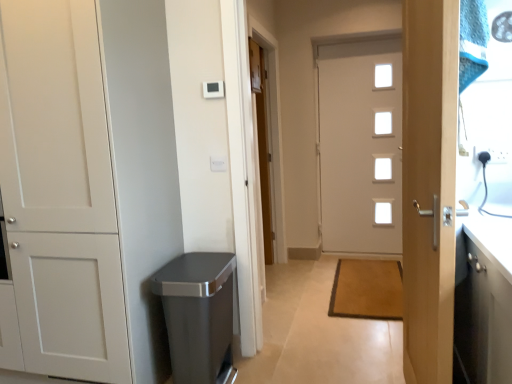
Question: Considering the positions of white glossy door at center, the second door when ordered from left to right, and white glossy door at center, the second door from the back, in the image, is white glossy door at center, the second door when ordered from left to right, wider or thinner than white glossy door at center, the second door from the back,?

Choices:
 (A) thin
 (B) wide

Answer: (A)

Question: Relative to white glossy door at center, acting as the fourth door starting from the left, is white glossy door at center, the second door when ordered from left to right, in front or behind?

Choices:
 (A) front
 (B) behind

Answer: (B)

Question: Estimate the real-world distances between objects in this image. Which object is closer to the white glossy door at center, which appears as the 1th door when viewed from the back?

Choices:
 (A) brown textured mat at center
 (B) light wood door handle at right, the third door positioned from the left
 (C) white matte cabinet at left, positioned as the first door in left-to-right order
 (D) white glossy door at center, the second door from the back
 (E) satin silver trash can at lower left

Answer: (D)

Question: Considering the real-world distances, which object is farthest from the white matte cabinet at left, which ranks as the fourth door in right-to-left order?

Choices:
 (A) white glossy door at center, the second door from the back
 (B) white glossy door at center, which appears as the 1th door when viewed from the back
 (C) light wood door handle at right, acting as the second door starting from the right
 (D) brown textured mat at center
 (E) satin silver trash can at lower left

Answer: (A)